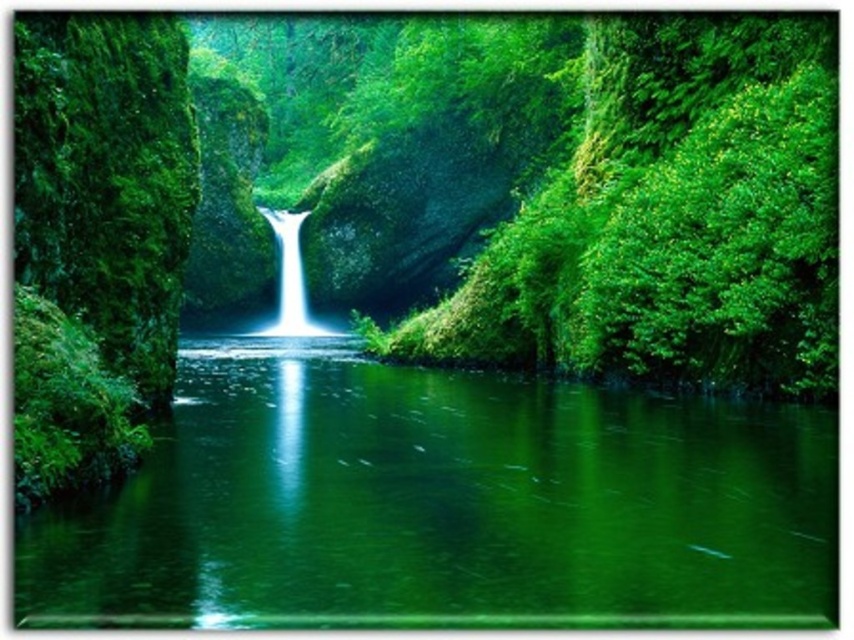
Who is more forward, (705, 528) or (121, 300)?

Positioned in front is point (705, 528).

Where is `green glossy river at center`? The width and height of the screenshot is (854, 640). green glossy river at center is located at coordinates (442, 504).

Is green mossy rock at left above white smooth waterfall at center?

Actually, green mossy rock at left is below white smooth waterfall at center.

Does point (18, 504) come farther from viewer compared to point (295, 326)?

No, (18, 504) is closer to viewer.

Is point (142, 342) closer to camera compared to point (282, 262)?

Yes, point (142, 342) is in front of point (282, 262).

Identify the location of green mossy rock at left. (97, 237).

Between green glossy river at center and white smooth waterfall at center, which one appears on the left side from the viewer's perspective?

Positioned to the left is white smooth waterfall at center.

Does green glossy river at center appear on the right side of white smooth waterfall at center?

Indeed, green glossy river at center is positioned on the right side of white smooth waterfall at center.

Where is `green glossy river at center`? green glossy river at center is located at coordinates (442, 504).

Identify the location of green glossy river at center. (442, 504).